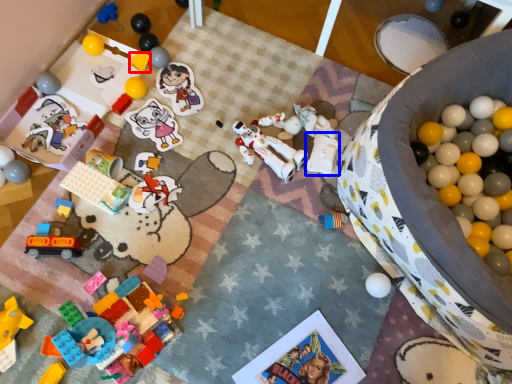
Question: Which point is further to the camera, toy (highlighted by a red box) or toy (highlighted by a blue box)?

Choices:
 (A) toy
 (B) toy

Answer: (A)